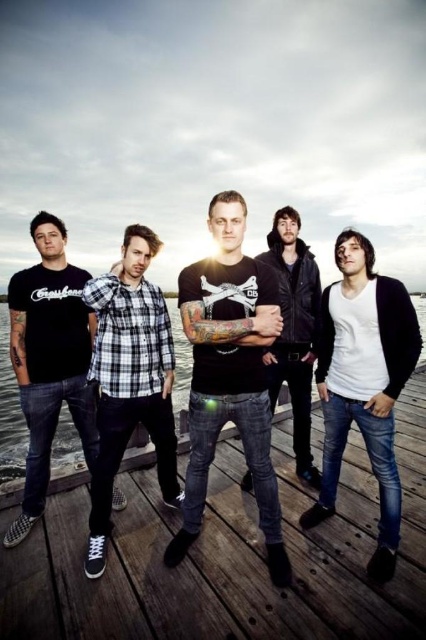
Question: Does white checkered shirt at center appear over black leather jacket at center?

Choices:
 (A) no
 (B) yes

Answer: (A)

Question: Which is farther from the wooden dock at center?

Choices:
 (A) black t-shirt at center
 (B) black matte t-shirt at center

Answer: (A)

Question: Which of the following is the closest to the observer?

Choices:
 (A) black matte t-shirt at left
 (B) transparent water at center
 (C) black matte t-shirt at center
 (D) wooden dock at center

Answer: (D)

Question: Can you confirm if black matte t-shirt at center is thinner than white checkered shirt at center?

Choices:
 (A) no
 (B) yes

Answer: (A)

Question: Which object is the farthest from the black t-shirt at center?

Choices:
 (A) black matte t-shirt at left
 (B) white matte sweater at center
 (C) black leather jacket at center
 (D) black matte t-shirt at center

Answer: (A)

Question: In this image, where is black matte t-shirt at center located relative to black leather jacket at center?

Choices:
 (A) left
 (B) right

Answer: (A)